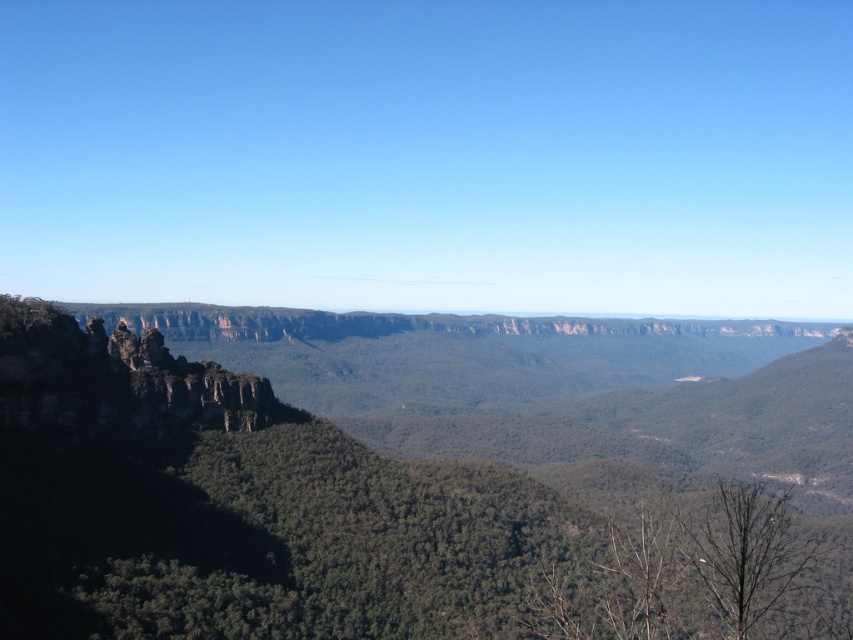
Question: Can you confirm if rugged rock formation at left is thinner than rugged stone rock formation at left?

Choices:
 (A) yes
 (B) no

Answer: (B)

Question: Can you confirm if rugged rock formation at left is positioned below rugged stone rock formation at left?

Choices:
 (A) yes
 (B) no

Answer: (A)

Question: Is rugged rock formation at left below rugged stone rock formation at left?

Choices:
 (A) no
 (B) yes

Answer: (B)

Question: Which point appears farthest from the camera in this image?

Choices:
 (A) (167, 412)
 (B) (585, 452)

Answer: (B)